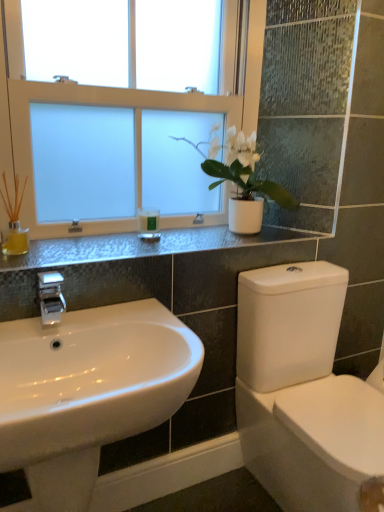
Find the location of `free space to the back side of silver metallic faucet at left`. free space to the back side of silver metallic faucet at left is located at coordinates (89, 312).